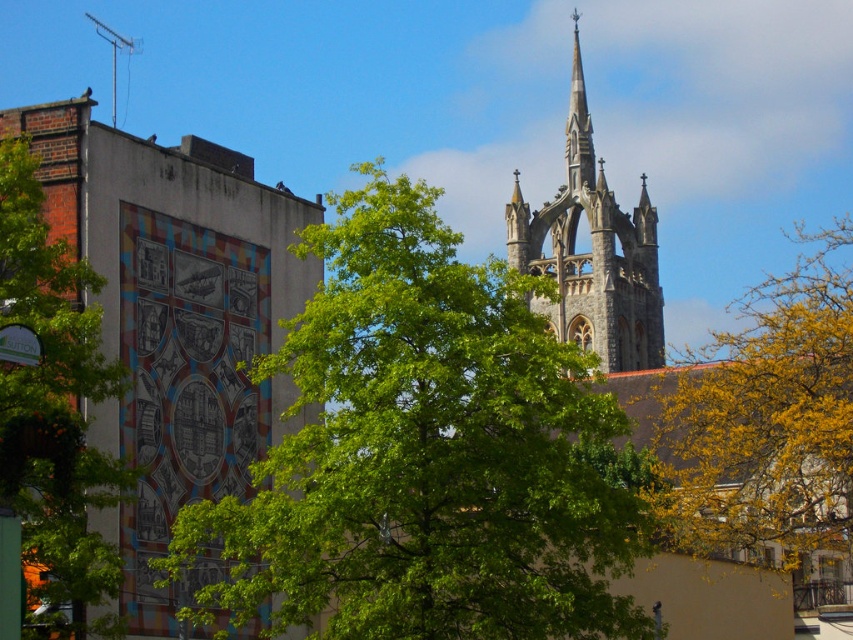
You are a bird looking for a place to perch. You see the yellow leafy tree at center and the green leafy tree at left. Which tree is closer to you?

The yellow leafy tree at center is positioned under the green leafy tree at left, meaning the green leafy tree at left is closer to you.